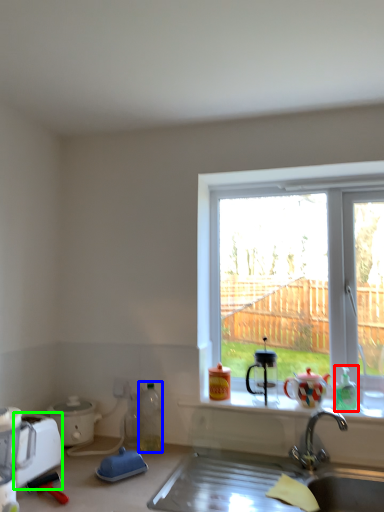
Question: Which object is the closest to the bottle (highlighted by a red box)? Choose among these: bottle (highlighted by a blue box) or appliance (highlighted by a green box).

Choices:
 (A) bottle
 (B) appliance

Answer: (A)